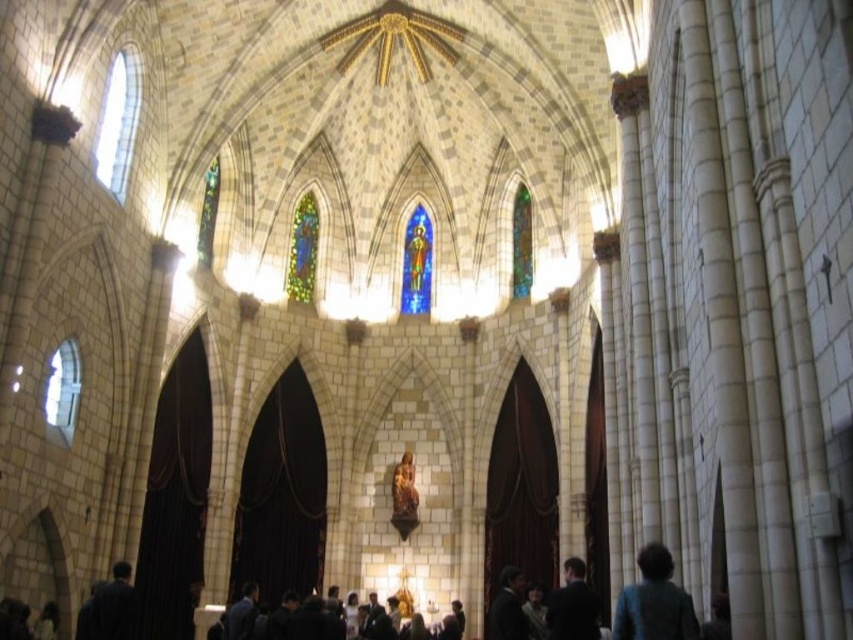
Question: Can you confirm if teal fabric coat at lower right is bigger than stained glass window at upper center?

Choices:
 (A) yes
 (B) no

Answer: (A)

Question: Which object appears farthest from the camera in this image?

Choices:
 (A) multicolored stained glass at upper center
 (B) matte gold statue at center
 (C) dark suit at lower right
 (D) teal fabric coat at lower right

Answer: (A)

Question: Among these points, which one is nearest to the camera?

Choices:
 (A) (293, 284)
 (B) (503, 592)
 (C) (216, 188)
 (D) (625, 620)

Answer: (D)

Question: Is the position of dark suit jackets at center less distant than that of dark suit at lower center?

Choices:
 (A) yes
 (B) no

Answer: (B)

Question: Which of the following is the closest to the observer?

Choices:
 (A) (213, 234)
 (B) (514, 604)
 (C) (619, 628)

Answer: (C)

Question: From the image, what is the correct spatial relationship of teal fabric coat at lower right in relation to clear glass window at lower left?

Choices:
 (A) above
 (B) below

Answer: (B)